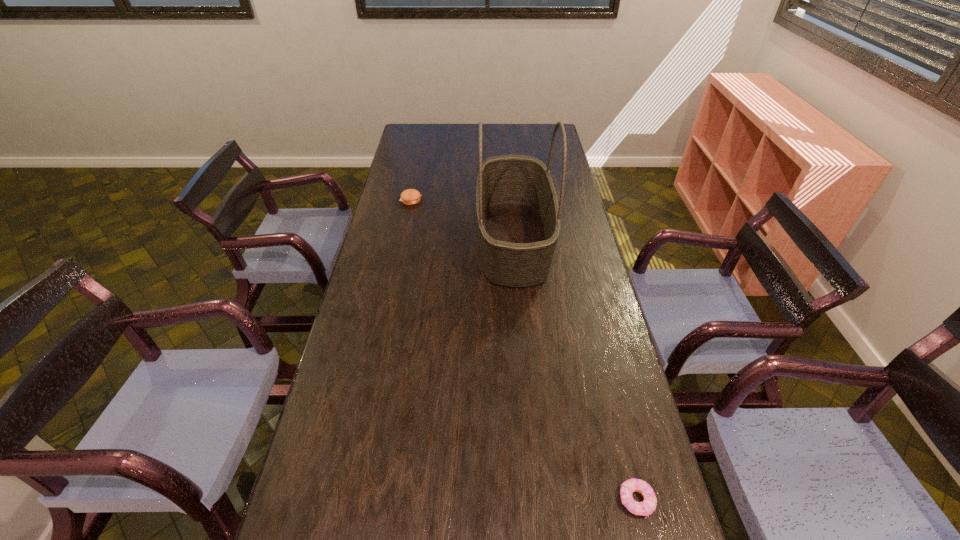
The image size is (960, 540). Identify the location of the second object from left to right. (518, 216).

The image size is (960, 540). In order to click on the tallest object in this screenshot , I will do `click(518, 216)`.

Where is `the second tallest object`? the second tallest object is located at coordinates (410, 196).

This screenshot has height=540, width=960. In order to click on the leftmost object in this screenshot , I will do `click(410, 196)`.

The height and width of the screenshot is (540, 960). Identify the location of the rightmost object. (647, 507).

In order to click on the shortest object in this screenshot , I will do `click(647, 507)`.

Where is `vacant area located 0.280m on the left of the second object from left to right`? The width and height of the screenshot is (960, 540). vacant area located 0.280m on the left of the second object from left to right is located at coordinates (402, 240).

Identify the location of vacant space located 0.320m on the front of the leftmost object. (399, 256).

The image size is (960, 540). Identify the location of vacant space located 0.060m on the left of the shortest object. (592, 500).

Image resolution: width=960 pixels, height=540 pixels. What are the coordinates of `object that is at the left edge` in the screenshot? It's located at [x=410, y=196].